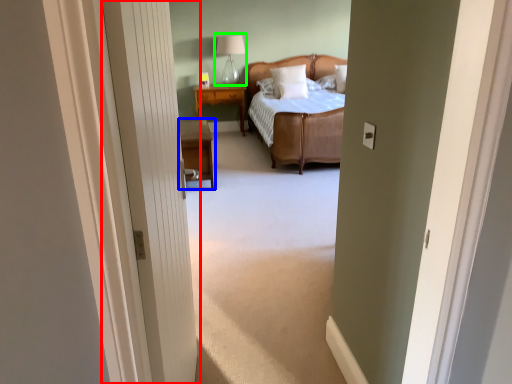
Question: Which object is the farthest from door (highlighted by a red box)? Choose among these: nightstand (highlighted by a blue box) or table lamp (highlighted by a green box).

Choices:
 (A) nightstand
 (B) table lamp

Answer: (B)